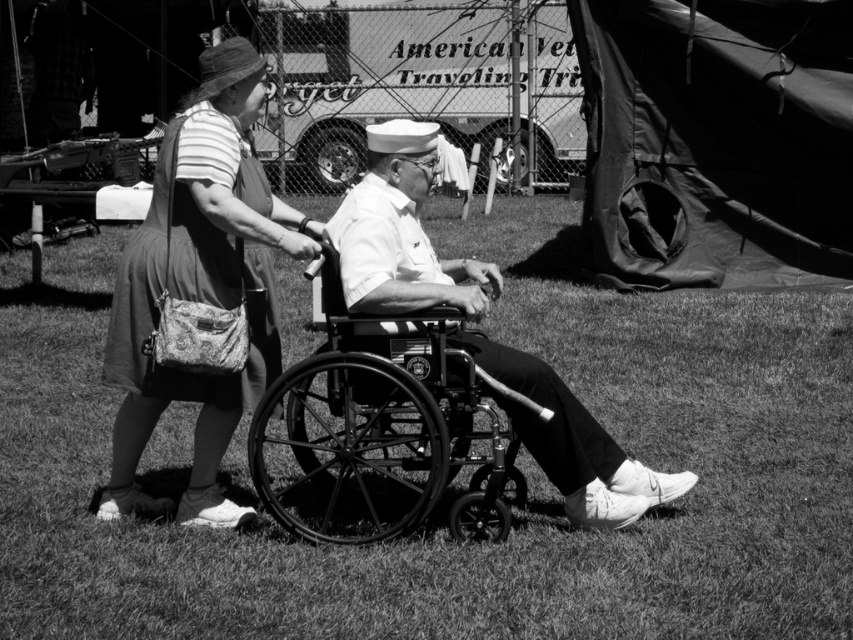
Question: Is matte fabric dress at center further to the viewer compared to black metal wheelchair at center?

Choices:
 (A) yes
 (B) no

Answer: (A)

Question: Observing the image, what is the correct spatial positioning of matte fabric dress at center in reference to black metal wheelchair at center?

Choices:
 (A) left
 (B) right

Answer: (A)

Question: Which object is positioned closest to the matte fabric dress at center?

Choices:
 (A) metallic wheelchair at center
 (B) black metal wheelchair at center

Answer: (B)

Question: Does matte fabric dress at center appear over black metal wheelchair at center?

Choices:
 (A) yes
 (B) no

Answer: (A)

Question: Which point is farther to the camera?

Choices:
 (A) metallic wheelchair at center
 (B) grass at center

Answer: (A)

Question: Which point appears closest to the camera in this image?

Choices:
 (A) (289, 625)
 (B) (575, 509)
 (C) (256, 320)

Answer: (A)